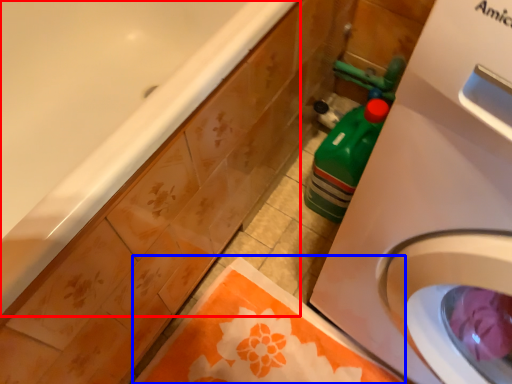
Question: Which object appears farthest to the camera in this image, bathtub (highlighted by a red box) or beach towel (highlighted by a blue box)?

Choices:
 (A) bathtub
 (B) beach towel

Answer: (B)